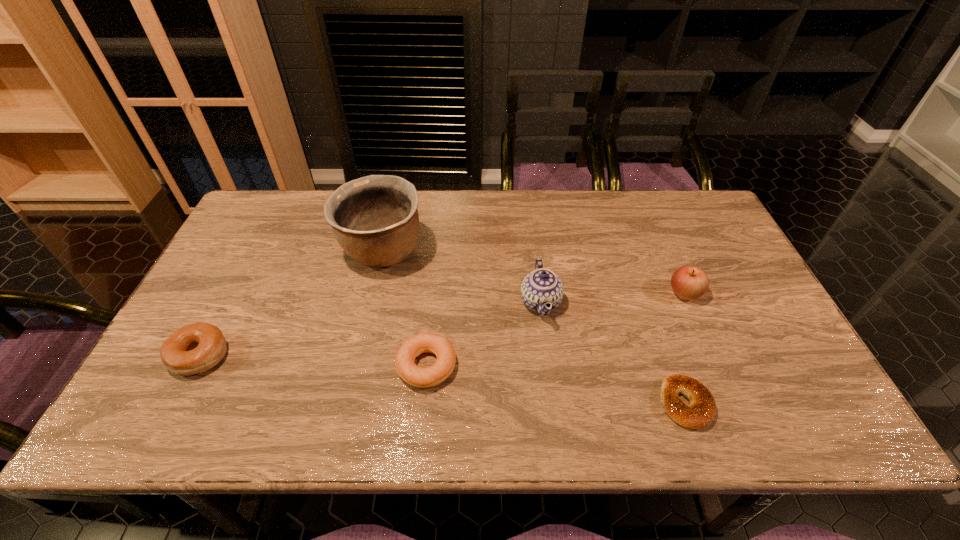
At what (x,y) coordinates should I click in order to perform the action: click on vacant space situated 0.060m on the front of the pottery. Please return your answer as a coordinate pair (x, y). The height and width of the screenshot is (540, 960). Looking at the image, I should click on (372, 299).

I want to click on vacant space located 0.350m at the spout of the third object from right to left, so click(x=390, y=302).

This screenshot has height=540, width=960. I want to click on vacant space located 0.310m at the spout of the third object from right to left, so 405,302.

This screenshot has width=960, height=540. Find the location of `vacant region located at the spout of the third object from right to left`. vacant region located at the spout of the third object from right to left is located at coordinates (431, 302).

This screenshot has width=960, height=540. In order to click on vacant region located on the front of the apple in this screenshot , I will do `click(720, 375)`.

The height and width of the screenshot is (540, 960). I want to click on vacant region located 0.220m on the back of the fourth tallest object, so click(x=244, y=273).

The height and width of the screenshot is (540, 960). I want to click on blank space located on the left of the second bagel from right to left, so click(x=279, y=366).

This screenshot has width=960, height=540. Find the location of `vacant region located 0.400m on the left of the shortest object`. vacant region located 0.400m on the left of the shortest object is located at coordinates (480, 403).

Locate an element on the screen. object at the far edge is located at coordinates (375, 220).

You are a GUI agent. You are given a task and a screenshot of the screen. Output one action in this format:
    pyautogui.click(x=<x>, y=<y>)
    Task: Click on the object present at the near edge
    The width and height of the screenshot is (960, 540).
    Given the screenshot: What is the action you would take?
    pyautogui.click(x=699, y=413)